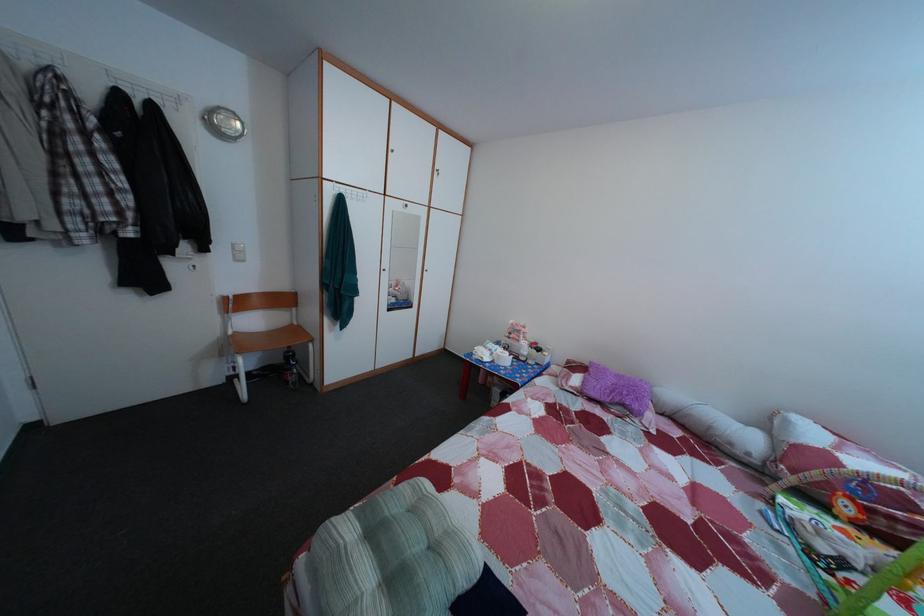
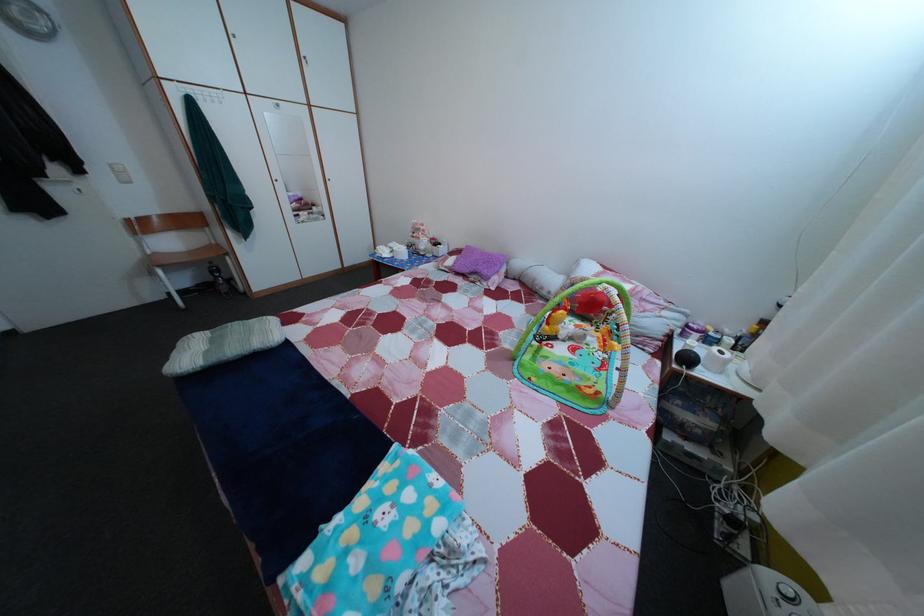
Where in the second image is the point corresponding to (x=245, y=339) from the first image?

(164, 261)